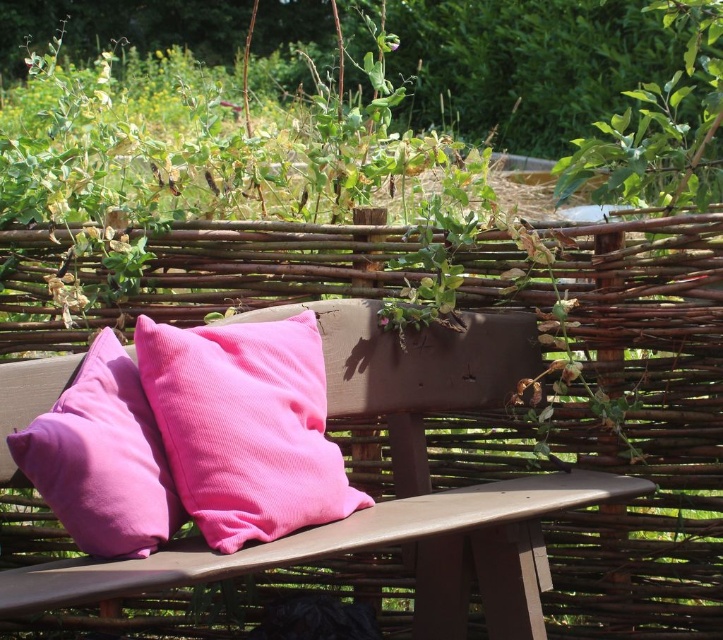
Question: Is pink corduroy pillow at center in front of pink corduroy pillow at left?

Choices:
 (A) no
 (B) yes

Answer: (A)

Question: Which point appears closest to the camera in this image?

Choices:
 (A) 226,433
 (B) 346,538

Answer: (B)

Question: Which point is closer to the camera?

Choices:
 (A) pink corduroy pillow at left
 (B) matte wood park bench at center

Answer: (B)

Question: Does matte wood park bench at center appear under pink corduroy pillow at center?

Choices:
 (A) yes
 (B) no

Answer: (A)

Question: Which is farther from the pink corduroy pillow at center?

Choices:
 (A) pink corduroy pillow at left
 (B) matte wood park bench at center

Answer: (B)

Question: Can you confirm if matte wood park bench at center is positioned above pink corduroy pillow at left?

Choices:
 (A) yes
 (B) no

Answer: (B)